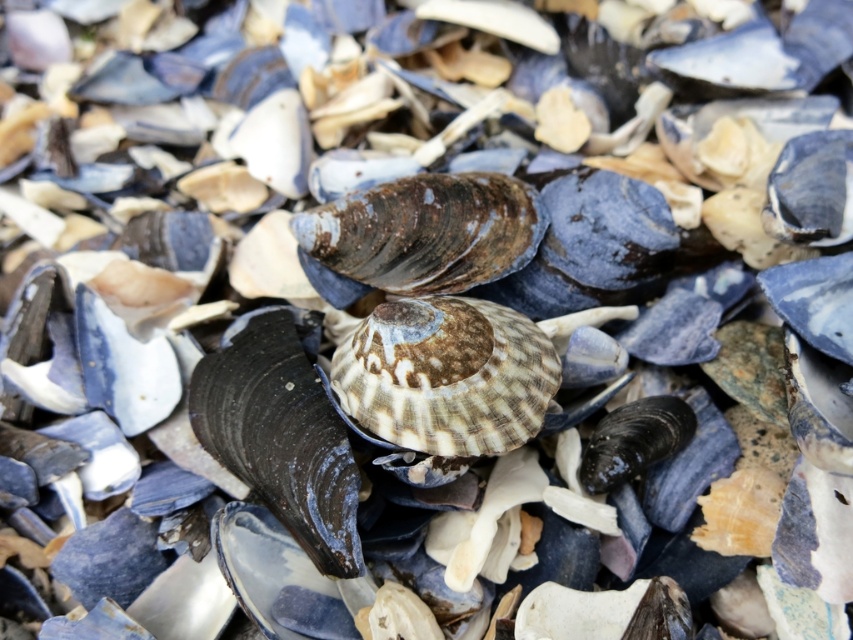
Question: Which object appears closest to the camera in this image?

Choices:
 (A) speckled brown shell at center
 (B) rusty metallic shellfish at center

Answer: (A)

Question: Observing the image, what is the correct spatial positioning of speckled brown shell at center in reference to rusty metallic shellfish at center?

Choices:
 (A) right
 (B) left

Answer: (A)

Question: Can you confirm if speckled brown shell at center is positioned above rusty metallic shellfish at center?

Choices:
 (A) yes
 (B) no

Answer: (B)

Question: Is speckled brown shell at center further to camera compared to rusty metallic shellfish at center?

Choices:
 (A) yes
 (B) no

Answer: (B)